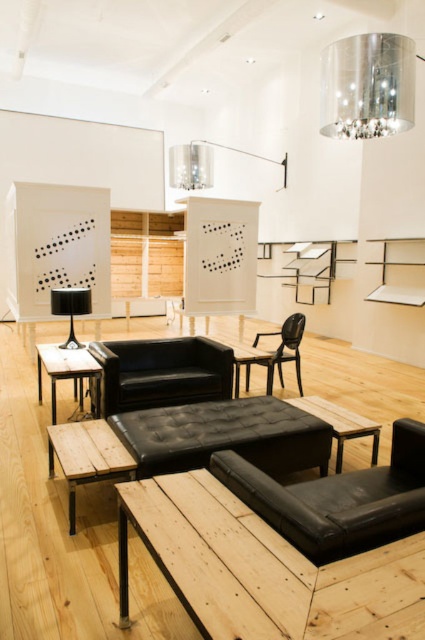
Does tufted leather ottoman at center have a lesser height compared to transparent plastic armchair at center?

Indeed, tufted leather ottoman at center has a lesser height compared to transparent plastic armchair at center.

Is point (130, 424) positioned before point (280, 330)?

Yes, it is.

Describe the element at coordinates (224, 435) in the screenshot. This screenshot has height=640, width=425. I see `tufted leather ottoman at center` at that location.

Image resolution: width=425 pixels, height=640 pixels. Identify the location of tufted leather ottoman at center. (224, 435).

Who is positioned more to the right, black leather armchair at lower right or wooden table at lower left?

black leather armchair at lower right

Is black leather armchair at lower right thinner than wooden table at lower left?

Indeed, black leather armchair at lower right has a lesser width compared to wooden table at lower left.

At what (x,y) coordinates should I click in order to perform the action: click on black leather armchair at lower right. Please return your answer as a coordinate pair (x, y). The width and height of the screenshot is (425, 640). Looking at the image, I should click on (337, 499).

Is the position of wooden table at center more distant than that of shiny metallic chandelier at upper center?

No, wooden table at center is closer to the viewer.

Can you confirm if wooden table at center is positioned above shiny metallic chandelier at upper center?

No.

The width and height of the screenshot is (425, 640). What are the coordinates of `wooden table at center` in the screenshot? It's located at pos(340,424).